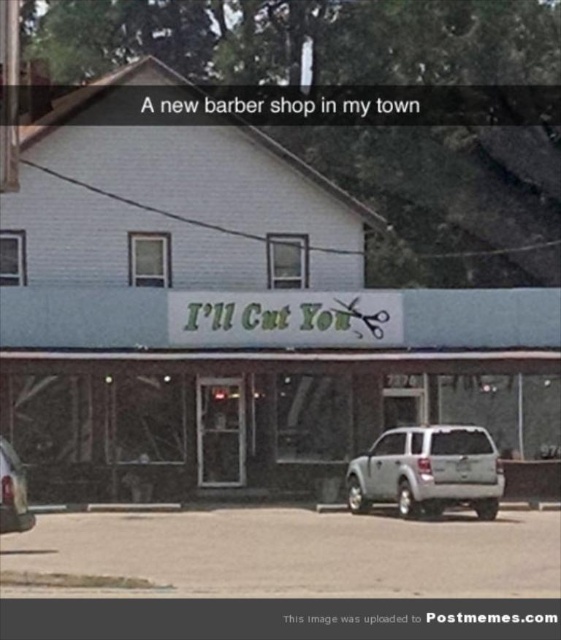
Does point (448, 435) come behind point (20, 472)?

Yes, point (448, 435) is farther from viewer.

Who is positioned more to the right, satin silver suv at center or silver metallic suv at center?

satin silver suv at center

Does point (439, 436) come farther from viewer compared to point (16, 513)?

That is True.

This screenshot has height=640, width=561. I want to click on satin silver suv at center, so click(x=427, y=472).

Based on the photo, who is shorter, white matte building at center or silver metallic suv at center?

silver metallic suv at center is shorter.

Can you confirm if white matte building at center is smaller than silver metallic suv at center?

No, white matte building at center is not smaller than silver metallic suv at center.

Is point (191, 312) in front of point (20, 461)?

No, it is not.

Find the location of a particular element. This screenshot has height=640, width=561. white matte building at center is located at coordinates (228, 317).

Where is `white matte building at center`? This screenshot has width=561, height=640. white matte building at center is located at coordinates click(x=228, y=317).

Does white matte building at center have a larger size compared to satin silver suv at center?

Correct, white matte building at center is larger in size than satin silver suv at center.

What do you see at coordinates (228, 317) in the screenshot? I see `white matte building at center` at bounding box center [228, 317].

I want to click on white matte building at center, so click(228, 317).